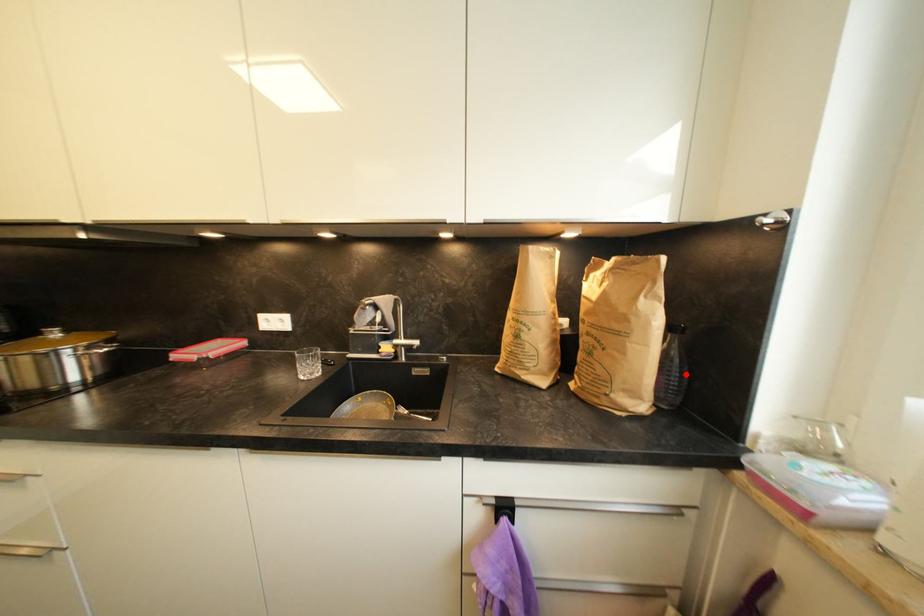
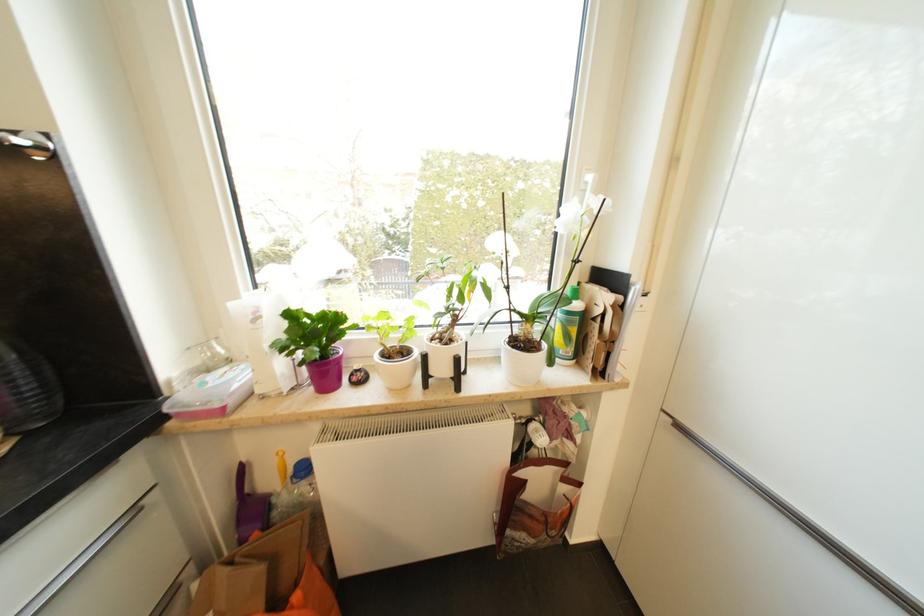
Find the pixel in the second image that matches the highlighted location in the first image.

(37, 370)